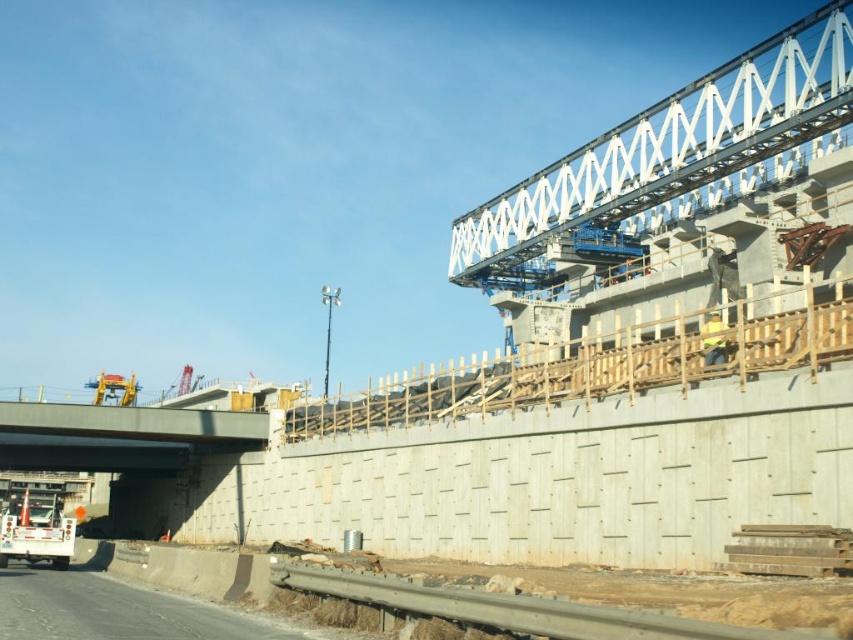
Question: Does gray concrete highway at lower left have a smaller size compared to yellow reflective vest at center?

Choices:
 (A) no
 (B) yes

Answer: (A)

Question: Which object is the farthest from the white metallic bridge at upper right?

Choices:
 (A) gray metallic overpass at left
 (B) gray concrete highway at lower left
 (C) yellow reflective vest at center

Answer: (B)

Question: Which object appears closest to the camera in this image?

Choices:
 (A) white metallic bridge at upper right
 (B) yellow reflective vest at center

Answer: (B)

Question: Is gray metallic overpass at left thinner than gray concrete highway at lower left?

Choices:
 (A) yes
 (B) no

Answer: (B)

Question: Is white metallic bridge at upper right to the right of yellow reflective vest at center from the viewer's perspective?

Choices:
 (A) no
 (B) yes

Answer: (B)

Question: Based on their relative distances, which object is farther from the gray concrete highway at lower left?

Choices:
 (A) yellow reflective vest at center
 (B) gray metallic overpass at left

Answer: (B)